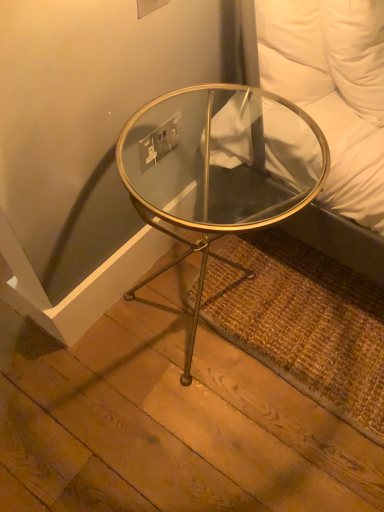
Consider the image. Measure the distance between point (146, 164) and camera.

Point (146, 164) and camera are 3.36 feet apart.

Identify the location of white plastic electric outlet at upper center. (159, 142).

The height and width of the screenshot is (512, 384). What do you see at coordinates (159, 142) in the screenshot? I see `white plastic electric outlet at upper center` at bounding box center [159, 142].

What are the coordinates of `clear glass table at center` in the screenshot? It's located at (222, 168).

What do you see at coordinates (222, 168) in the screenshot?
I see `clear glass table at center` at bounding box center [222, 168].

In order to face clear glass table at center, should I rotate leftwards or rightwards?

Rotate right and turn 1.997 degrees.

I want to click on white plastic electric outlet at upper center, so click(159, 142).

Does white plastic electric outlet at upper center appear on the left side of clear glass table at center?

Indeed, white plastic electric outlet at upper center is positioned on the left side of clear glass table at center.

Considering their positions, is white plastic electric outlet at upper center located in front of or behind clear glass table at center?

Visually, white plastic electric outlet at upper center is located behind clear glass table at center.

Does point (151, 138) appear closer or farther from the camera than point (187, 138)?

Point (151, 138) appears to be closer to the viewer than point (187, 138).

From the image's perspective, is white plastic electric outlet at upper center located above or below clear glass table at center?

From the image's perspective, white plastic electric outlet at upper center appears above clear glass table at center.

From a real-world perspective, which object stands above the other?

white plastic electric outlet at upper center, from a real-world perspective.

In the scene shown: Does white plastic electric outlet at upper center have a lesser width compared to clear glass table at center?

Correct, the width of white plastic electric outlet at upper center is less than that of clear glass table at center.

Considering the relative sizes of white plastic electric outlet at upper center and clear glass table at center in the image provided, is white plastic electric outlet at upper center shorter than clear glass table at center?

Indeed, white plastic electric outlet at upper center has a lesser height compared to clear glass table at center.

Considering the sizes of objects white plastic electric outlet at upper center and clear glass table at center in the image provided, who is smaller, white plastic electric outlet at upper center or clear glass table at center?

Smaller between the two is white plastic electric outlet at upper center.

Is clear glass table at center surrounded by white plastic electric outlet at upper center?

No, clear glass table at center is not surrounded by white plastic electric outlet at upper center.

Would you consider white plastic electric outlet at upper center to be distant from clear glass table at center?

No, white plastic electric outlet at upper center is not far away from clear glass table at center.

Could you tell me if white plastic electric outlet at upper center is turned towards clear glass table at center?

Yes, white plastic electric outlet at upper center is oriented towards clear glass table at center.

The width and height of the screenshot is (384, 512). I want to click on coffee table that appears in front of the white plastic electric outlet at upper center, so click(x=222, y=168).

Is clear glass table at center at the left side of white plastic electric outlet at upper center?

No.

Relative to white plastic electric outlet at upper center, is clear glass table at center in front or behind?

In the image, clear glass table at center appears in front of white plastic electric outlet at upper center.

Is point (230, 141) positioned before point (145, 138)?

That is False.

From the image's perspective, is clear glass table at center positioned above or below white plastic electric outlet at upper center?

Clearly, from the image's perspective, clear glass table at center is below white plastic electric outlet at upper center.

From a real-world perspective, is clear glass table at center above or below white plastic electric outlet at upper center?

From a real-world perspective, clear glass table at center is physically below white plastic electric outlet at upper center.

Considering the relative sizes of clear glass table at center and white plastic electric outlet at upper center in the image provided, is clear glass table at center wider than white plastic electric outlet at upper center?

Indeed, clear glass table at center has a greater width compared to white plastic electric outlet at upper center.

Can you confirm if clear glass table at center is shorter than white plastic electric outlet at upper center?

No, clear glass table at center is not shorter than white plastic electric outlet at upper center.

Considering the relative sizes of clear glass table at center and white plastic electric outlet at upper center in the image provided, is clear glass table at center smaller than white plastic electric outlet at upper center?

Actually, clear glass table at center might be larger than white plastic electric outlet at upper center.

Choose the correct answer: Is clear glass table at center inside white plastic electric outlet at upper center or outside it?

clear glass table at center lies outside white plastic electric outlet at upper center.

Would you consider clear glass table at center to be distant from white plastic electric outlet at upper center?

clear glass table at center is near white plastic electric outlet at upper center, not far away.

Is clear glass table at center oriented away from white plastic electric outlet at upper center?

That's right, clear glass table at center is facing away from white plastic electric outlet at upper center.

Can you tell me how much clear glass table at center and white plastic electric outlet at upper center differ in facing direction?

They differ by 0.453 degrees in their facing directions.

You are a GUI agent. You are given a task and a screenshot of the screen. Output one action in this format:
    pyautogui.click(x=<x>, y=<y>)
    Task: Click on the electric outlet behind the clear glass table at center
    
    Given the screenshot: What is the action you would take?
    pyautogui.click(x=159, y=142)

Where is `electric outlet on the left of clear glass table at center`? Image resolution: width=384 pixels, height=512 pixels. electric outlet on the left of clear glass table at center is located at coordinates (159, 142).

Identify the location of coffee table that appears in front of the white plastic electric outlet at upper center. This screenshot has width=384, height=512. (222, 168).